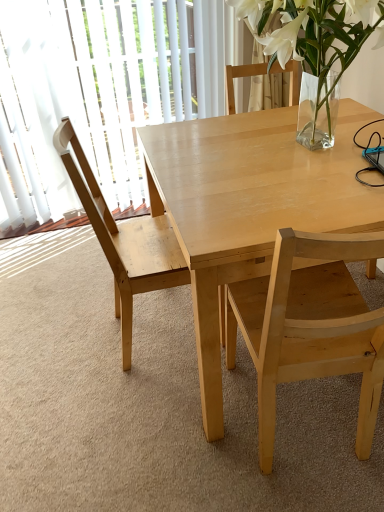
Identify the location of free space above light wood table at center (from a real-world perspective). (284, 151).